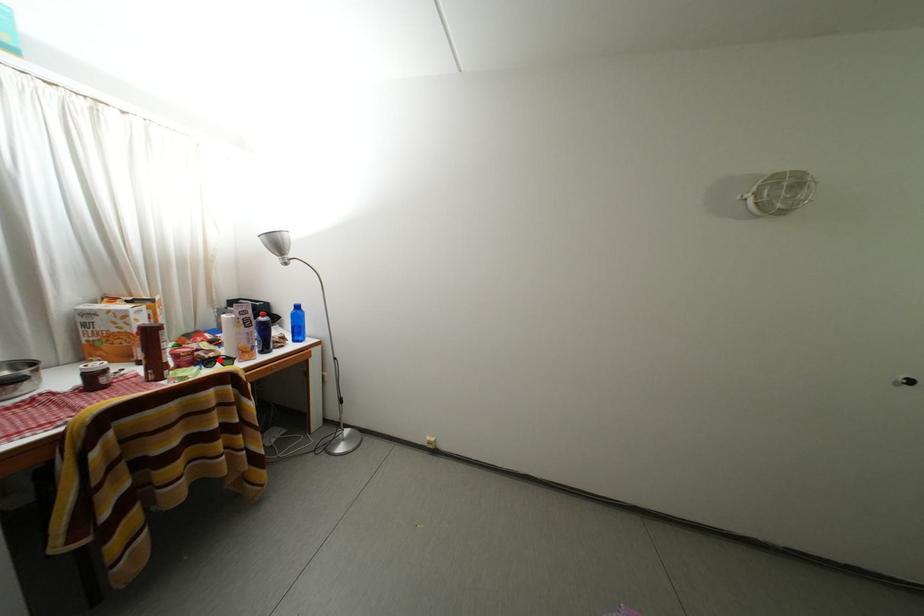
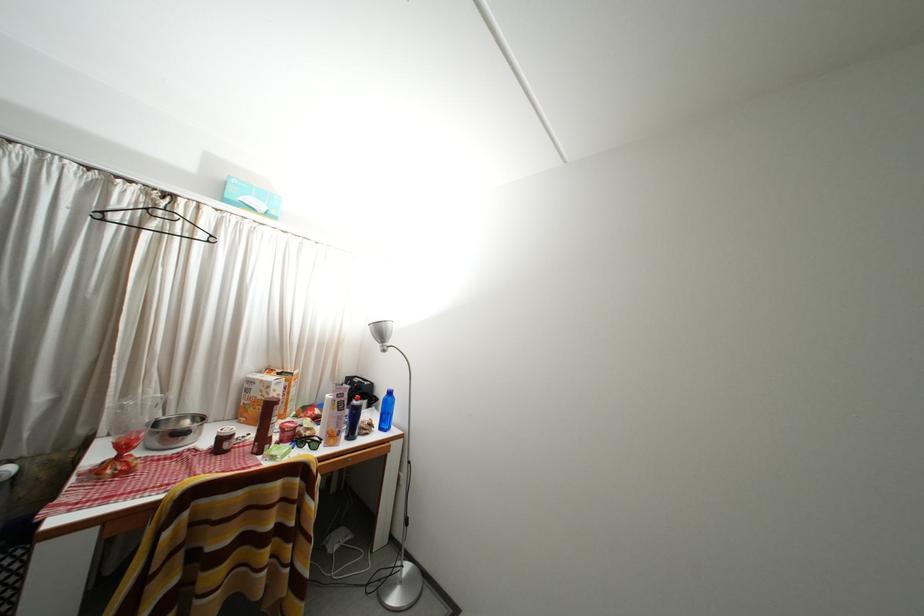
In the second image, find the point that corresponds to the highlighted location in the first image.

(315, 439)